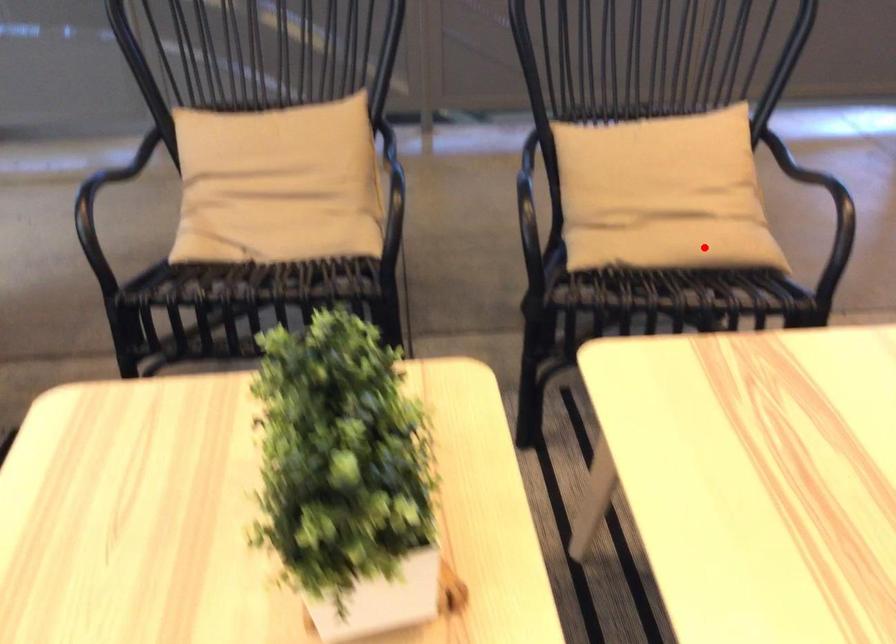
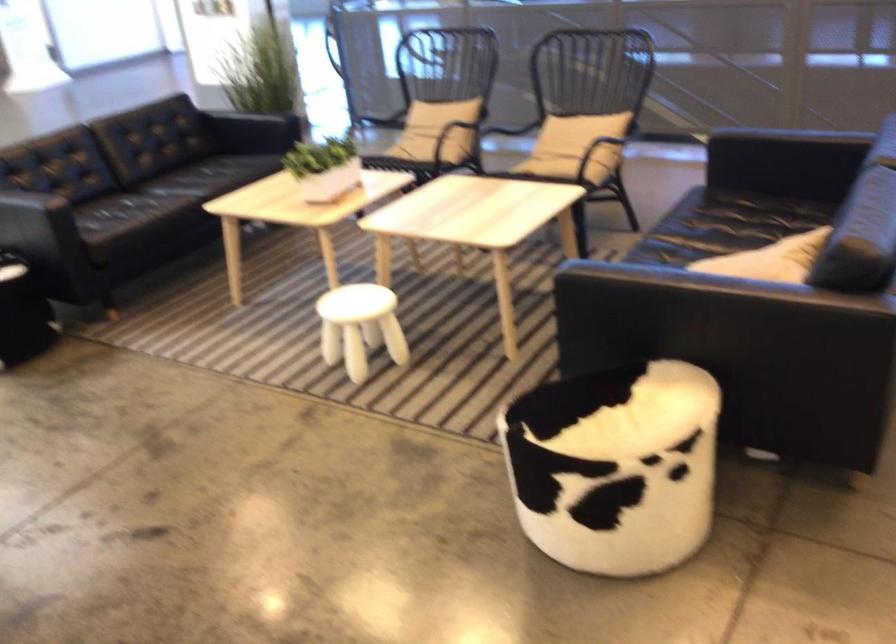
Question: I am providing you with two images of the same scene from different viewpoints. Image1 has a red point marked. In image2, the corresponding 3D location appears at what relative position? Reply with the corresponding letter.

Choices:
 (A) Closer
 (B) Farther

Answer: (B)